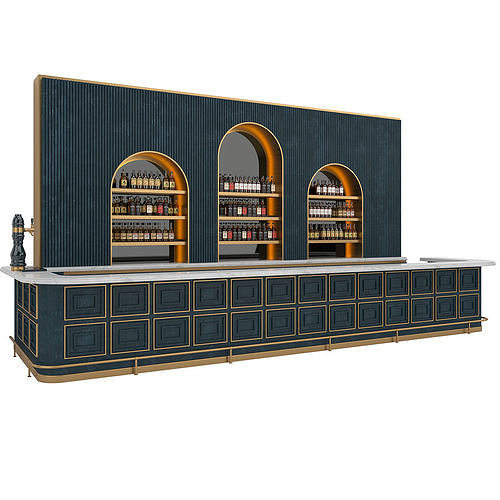
The width and height of the screenshot is (500, 500). I want to click on left most concave shelf area, left center, so click(x=143, y=164).